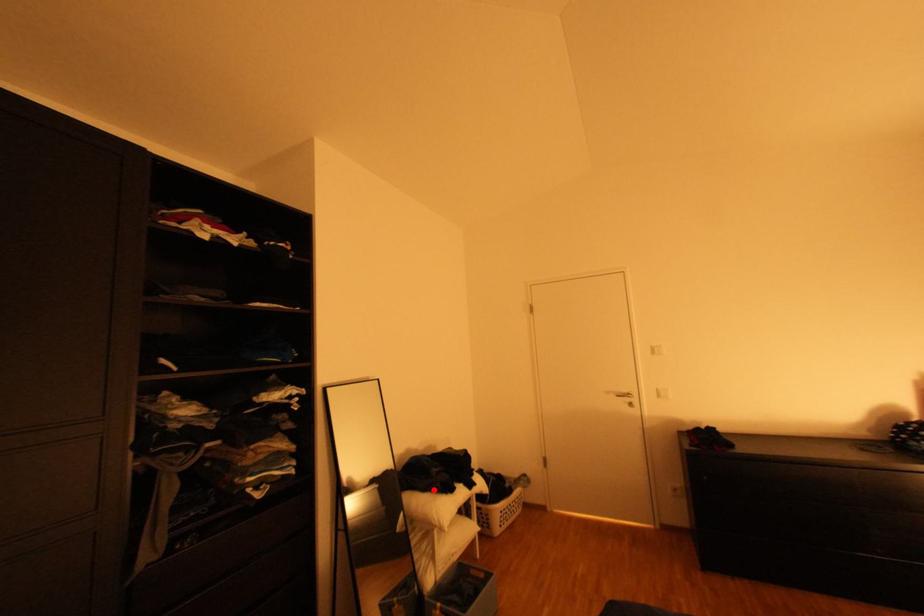
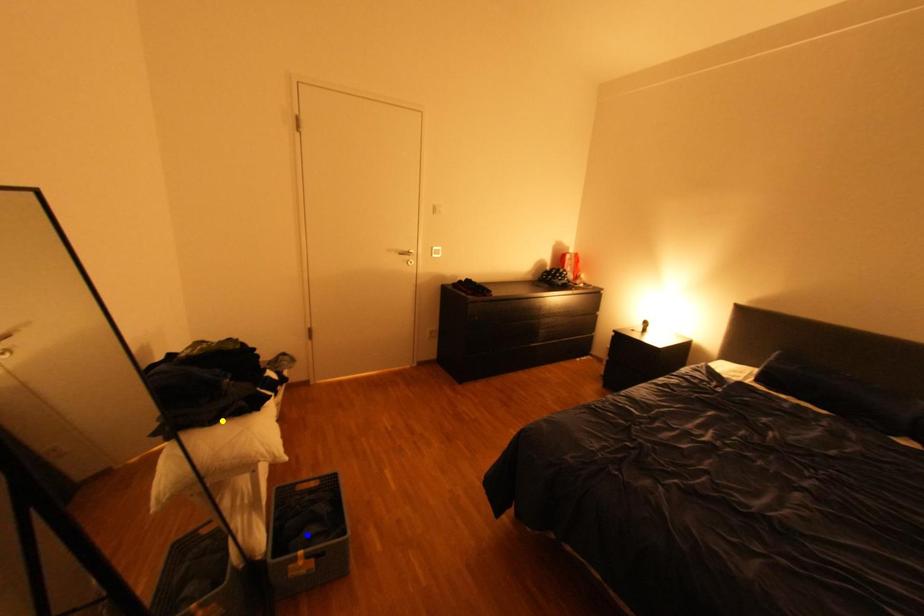
Question: I am providing you with two images of the same scene from different viewpoints. A red point is marked on the first image. You are given multiple points on the second image. Which point in image 2 represents the same 3d spot as the red point in image 1?

Choices:
 (A) green point
 (B) blue point
 (C) yellow point

Answer: (C)